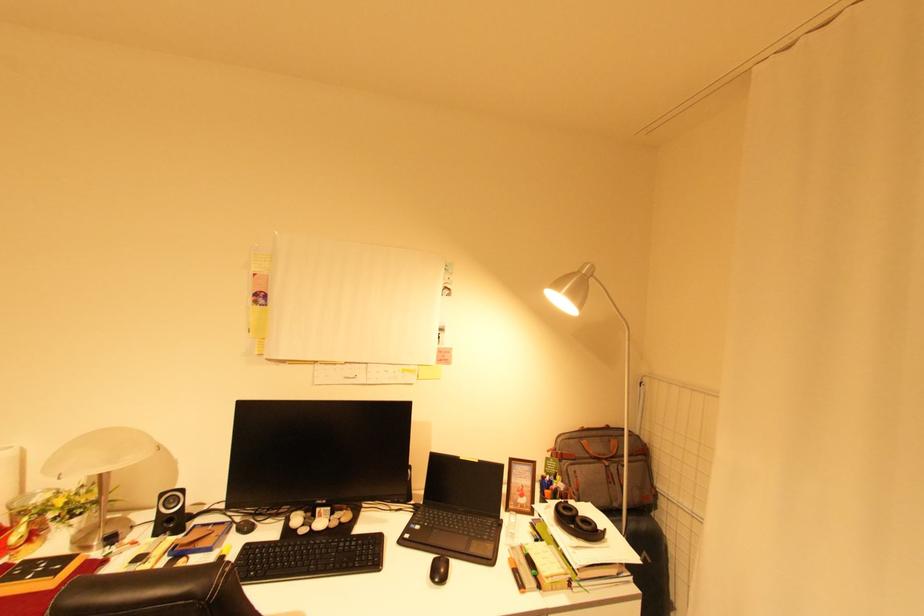
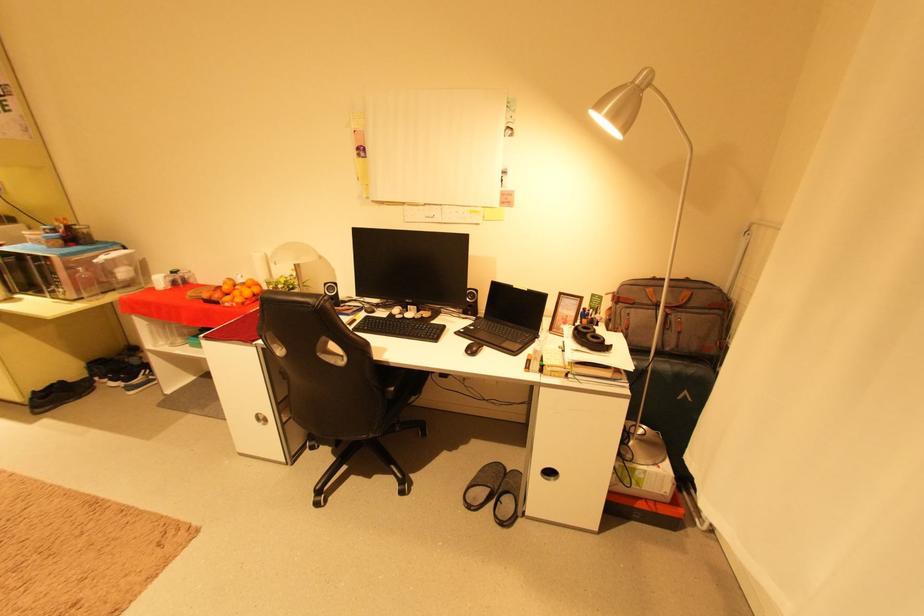
Find the pixel in the second image that matches (587,273) in the first image.

(639, 83)